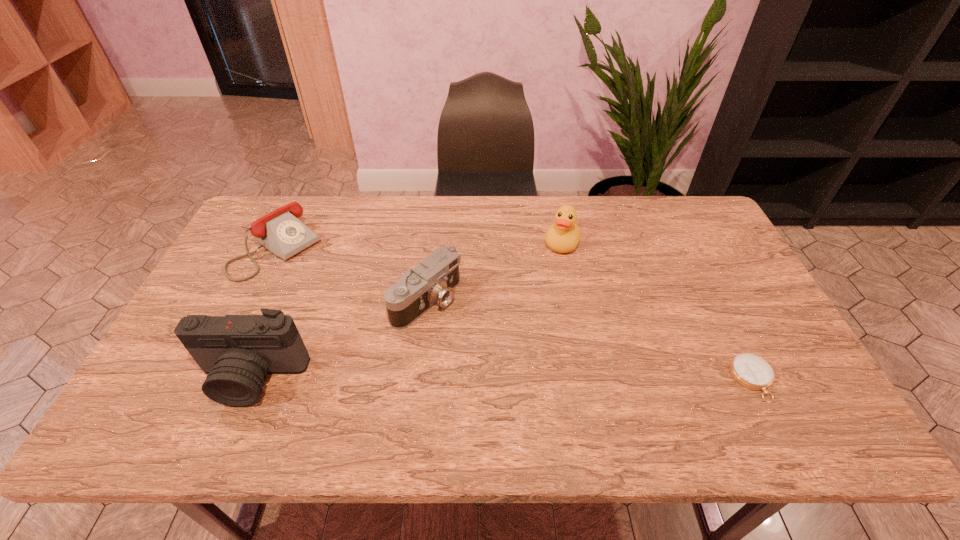
This screenshot has width=960, height=540. Find the location of `empty location between the second shortest object and the shortest object`. empty location between the second shortest object and the shortest object is located at coordinates click(515, 314).

Identify the location of object that is the closest to the compass. The width and height of the screenshot is (960, 540). (563, 236).

Where is `object that is the second closest to the telephone`? object that is the second closest to the telephone is located at coordinates (433, 281).

Identify the location of free space that satisfies the following two spatial constraints: 1. on the front side of the farther camera; 2. on the left side of the telephone. The width and height of the screenshot is (960, 540). (250, 300).

Where is `vacant region that satisfies the following two spatial constraints: 1. at the lens of the nearer camera; 2. on the right side of the compass`? Image resolution: width=960 pixels, height=540 pixels. vacant region that satisfies the following two spatial constraints: 1. at the lens of the nearer camera; 2. on the right side of the compass is located at coordinates (252, 380).

This screenshot has height=540, width=960. I want to click on free space that satisfies the following two spatial constraints: 1. at the lens of the shortest object; 2. on the left side of the nearer camera, so click(x=252, y=380).

The height and width of the screenshot is (540, 960). In order to click on vacant space that satisfies the following two spatial constraints: 1. at the lens of the shortest object; 2. on the right side of the left camera in this screenshot , I will do `click(252, 380)`.